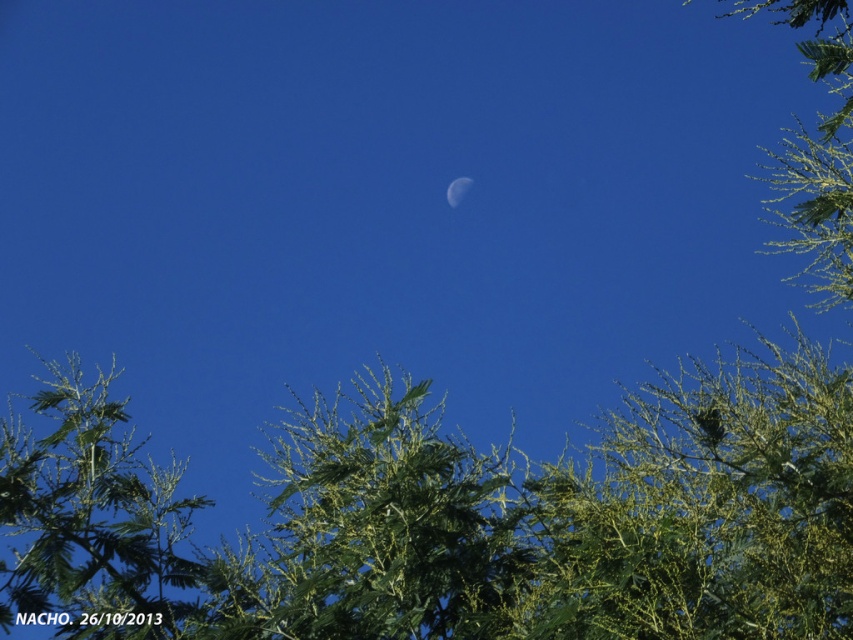
Who is shorter, green leafy tree at center or white glossy moon at center?

white glossy moon at center is shorter.

Is green leafy tree at center bigger than white glossy moon at center?

Yes, green leafy tree at center is bigger than white glossy moon at center.

I want to click on green leafy tree at center, so click(374, 529).

Between point (297, 595) and point (78, 605), which one is positioned behind?

Positioned behind is point (78, 605).

Identify the location of green leafy tree at center. (374, 529).

Can you confirm if green leafy tree at lower left is positioned below white glossy moon at center?

Yes, green leafy tree at lower left is below white glossy moon at center.

Does green leafy tree at lower left appear over white glossy moon at center?

No.

The height and width of the screenshot is (640, 853). In order to click on green leafy tree at lower left in this screenshot , I will do `click(90, 518)`.